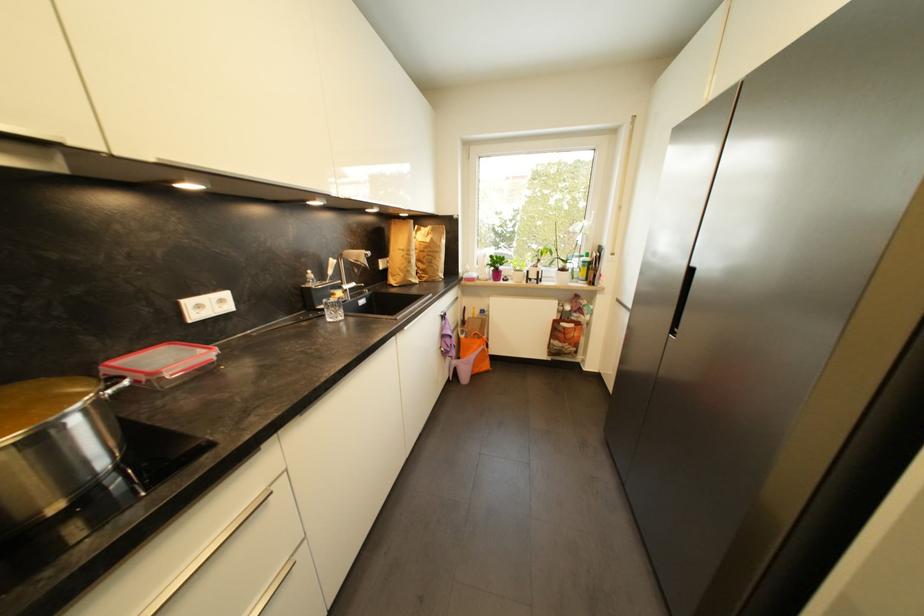
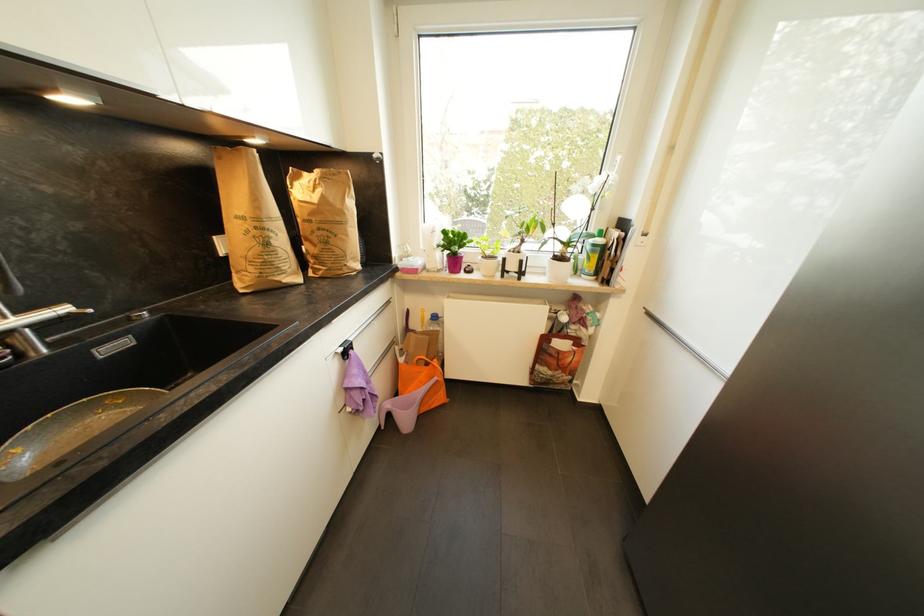
Locate, in the second image, the point that corresponds to [353,285] in the first image.

(27, 313)